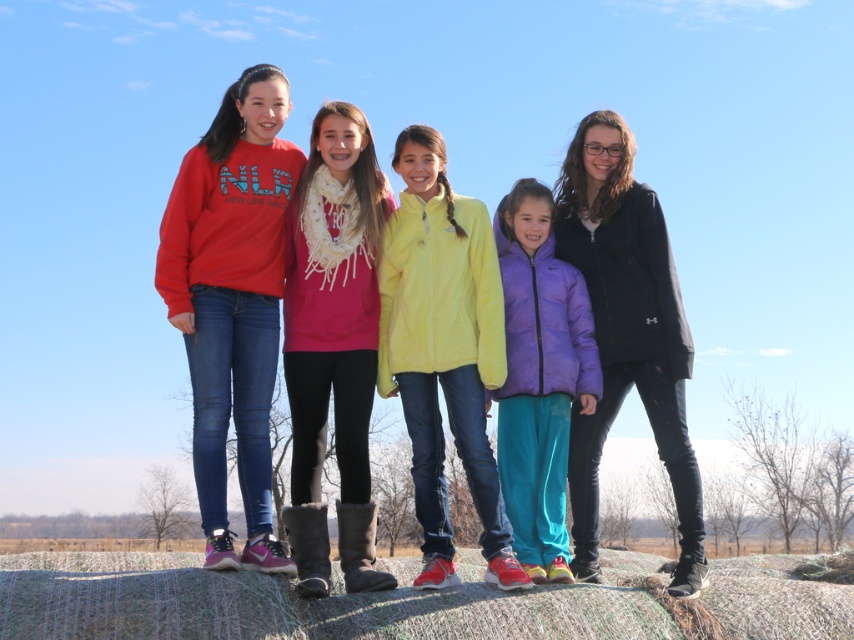
Question: Estimate the real-world distances between objects in this image. Which object is closer to the light yellow fleece jacket at center?

Choices:
 (A) matte fleece jackets at center
 (B) purple puffer jacket at center
 (C) black matte jacket at right
 (D) matte red sweatshirt at left

Answer: (A)

Question: Is matte red sweatshirt at left below white knit scarf at center?

Choices:
 (A) yes
 (B) no

Answer: (B)

Question: Which is nearer to the matte fleece jackets at center?

Choices:
 (A) matte red sweatshirt at left
 (B) light yellow fleece jacket at center

Answer: (B)

Question: Which of the following is the farthest from the observer?

Choices:
 (A) white knit scarf at center
 (B) purple puffer jacket at center
 (C) light yellow fleece jacket at center

Answer: (B)

Question: Is matte red sweatshirt at left to the left of white knit scarf at center from the viewer's perspective?

Choices:
 (A) no
 (B) yes

Answer: (B)

Question: Observing the image, what is the correct spatial positioning of matte red sweatshirt at left in reference to black matte jacket at right?

Choices:
 (A) above
 (B) below

Answer: (A)